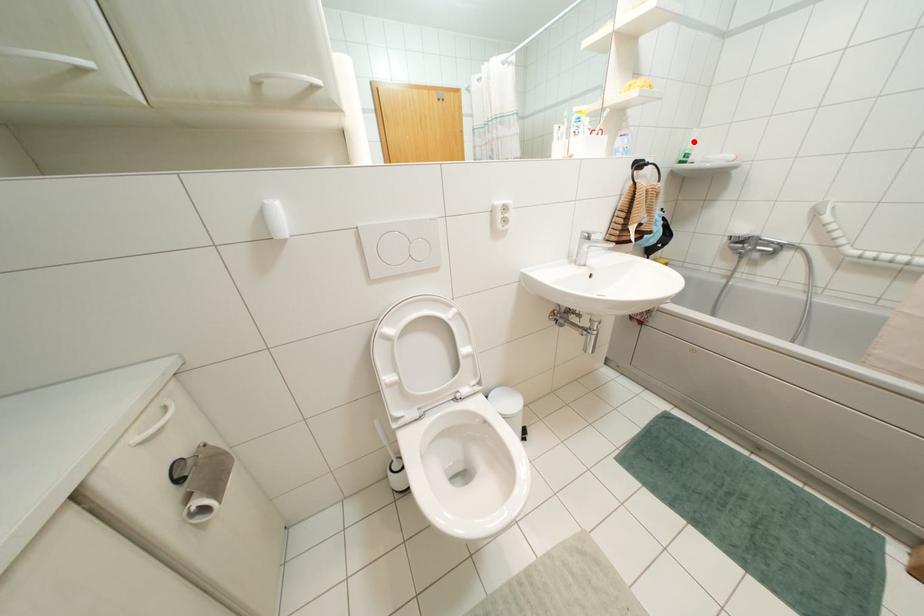
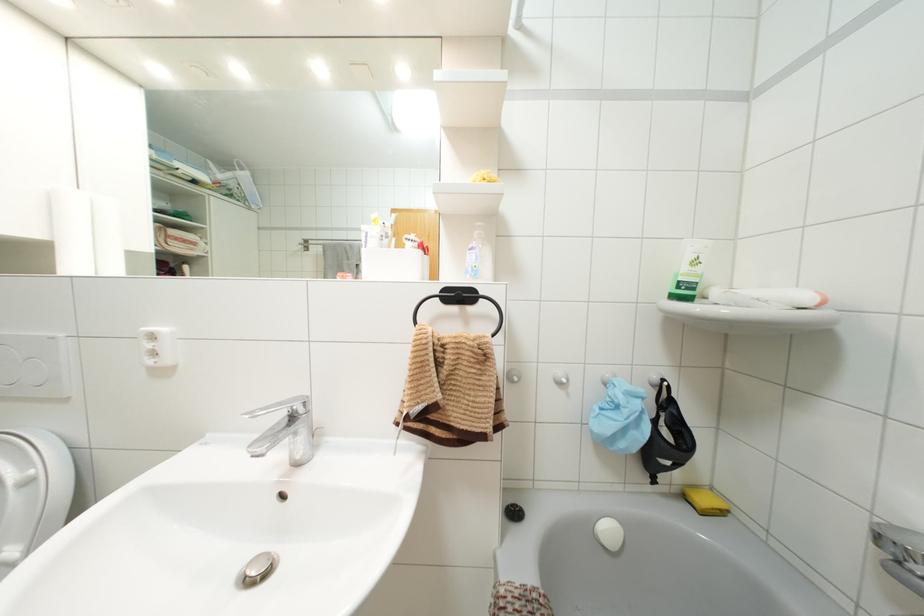
Where in the second image is the point corresponding to the highlighted location from the first image?

(695, 262)